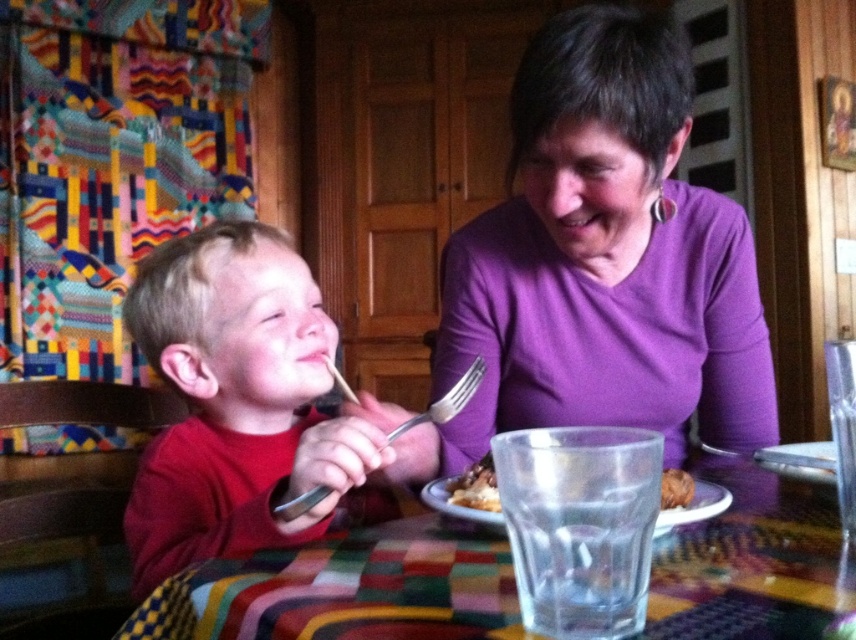
Question: Which point appears closest to the camera in this image?

Choices:
 (A) (282, 512)
 (B) (465, 632)
 (C) (687, 509)

Answer: (B)

Question: Which of the following is the farthest from the observer?

Choices:
 (A) pyautogui.click(x=446, y=397)
 (B) pyautogui.click(x=666, y=472)

Answer: (A)

Question: Which of the following is the closest to the observer?

Choices:
 (A) (664, 488)
 (B) (711, 512)

Answer: (B)

Question: Is matte red shirt at left smaller than white ceramic plate at center?

Choices:
 (A) no
 (B) yes

Answer: (A)

Question: Can you confirm if white ceramic plate at center is wider than clear glass at center?

Choices:
 (A) yes
 (B) no

Answer: (A)

Question: Is silvermetallicfork at center positioned in front of brown crumbly bread at lower center?

Choices:
 (A) no
 (B) yes

Answer: (B)